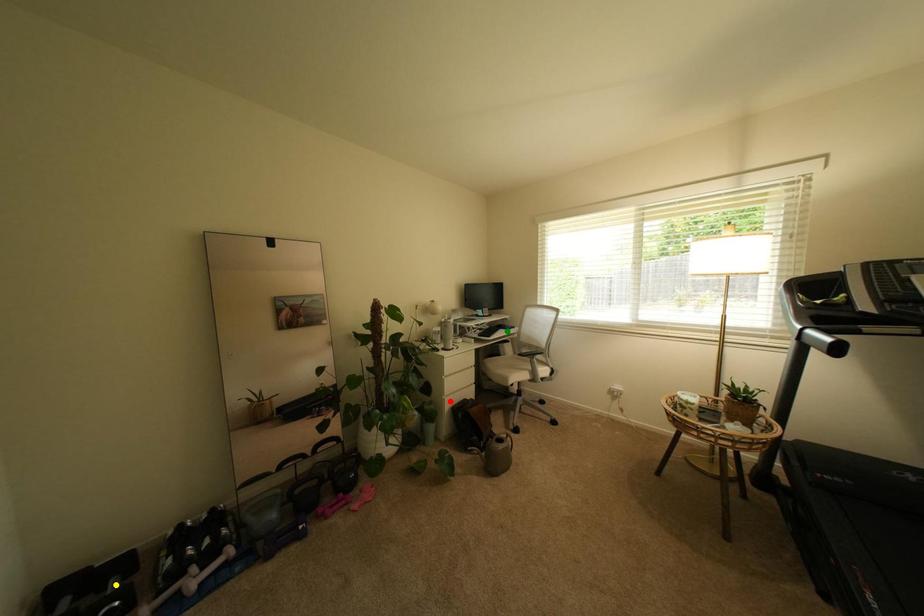
Order these from nearest to farthest:
green point
red point
yellow point

yellow point, red point, green point